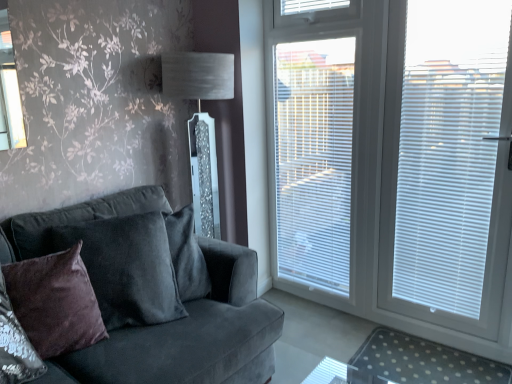
This screenshot has width=512, height=384. In order to click on vacant area on top of clear polka dot mat at lower right (from a real-world perspective) in this screenshot , I will do `click(426, 364)`.